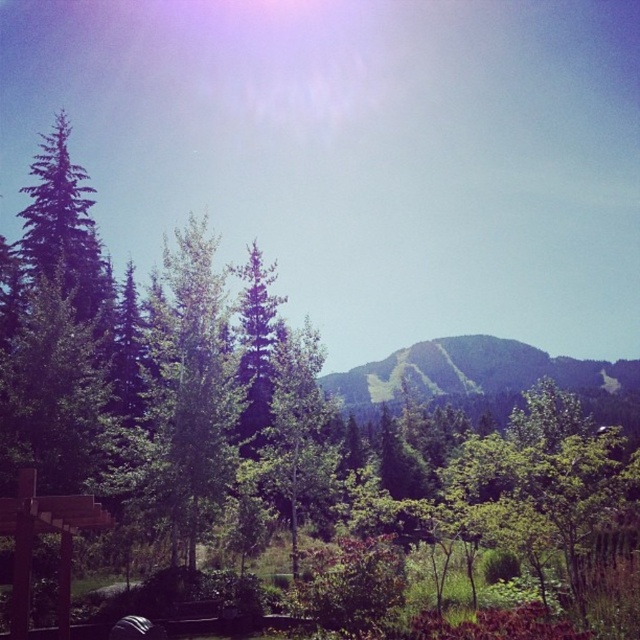
Question: Where is green leafy tree at center located in relation to green grassy mountain at center in the image?

Choices:
 (A) above
 (B) below

Answer: (A)

Question: Observing the image, what is the correct spatial positioning of green leafy tree at center in reference to green grassy mountain at center?

Choices:
 (A) right
 (B) left

Answer: (B)

Question: Which object is closer to the camera taking this photo?

Choices:
 (A) green leafy tree at center
 (B) green grassy mountain at center

Answer: (A)

Question: Where is green leafy tree at center located in relation to green grassy mountain at center in the image?

Choices:
 (A) below
 (B) above

Answer: (B)